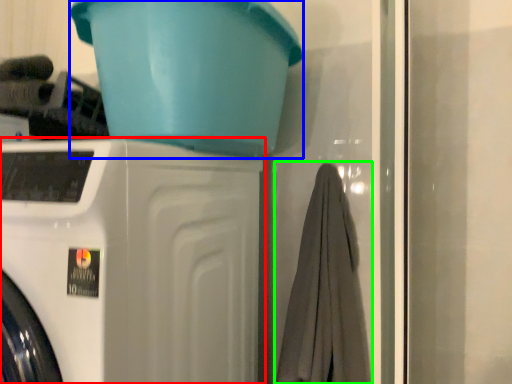
Question: Estimate the real-world distances between objects in this image. Which object is closer to washing machine (highlighted by a red box), basin (highlighted by a blue box) or bath towel (highlighted by a green box)?

Choices:
 (A) basin
 (B) bath towel

Answer: (A)